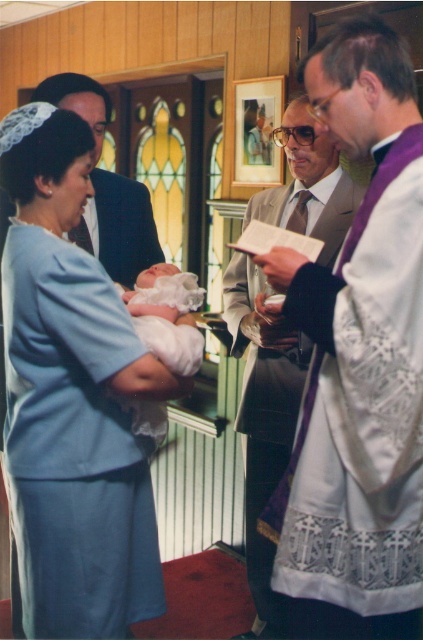
Question: Does matte blue dress at center have a greater width compared to white satin newborn at center?

Choices:
 (A) no
 (B) yes

Answer: (B)

Question: Which point is farther to the camera?

Choices:
 (A) purple lace robe at right
 (B) matte blue dress at center
 (C) matte gray suit at center
 (D) white satin newborn at center

Answer: (C)

Question: Does matte blue dress at center have a lesser width compared to white satin newborn at center?

Choices:
 (A) yes
 (B) no

Answer: (B)

Question: Which point is closer to the camera?

Choices:
 (A) (117, 518)
 (B) (156, 317)

Answer: (A)

Question: Which object is farther from the camera taking this photo?

Choices:
 (A) matte blue dress at center
 (B) white satin newborn at center
 (C) matte gray suit at center
 (D) purple lace robe at right

Answer: (C)

Question: Where is matte blue dress at center located in relation to purple lace robe at right in the image?

Choices:
 (A) left
 (B) right

Answer: (A)